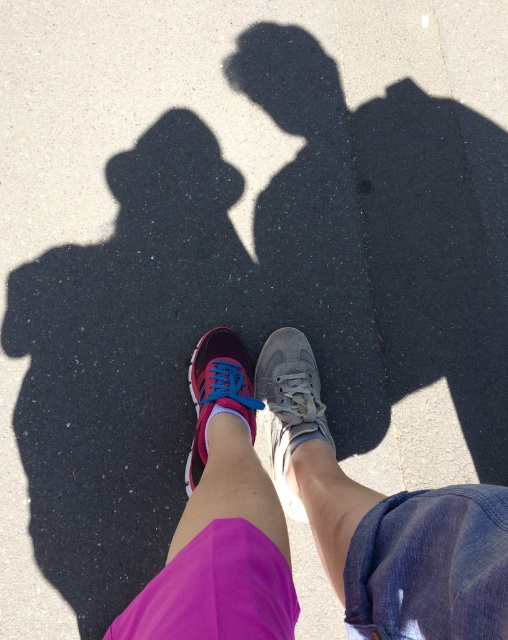
Does pink fabric shorts at lower center appear on the right side of shiny pink running shoe at center?

Correct, you'll find pink fabric shorts at lower center to the right of shiny pink running shoe at center.

Is pink fabric shorts at lower center closer to the viewer compared to shiny pink running shoe at center?

Yes, pink fabric shorts at lower center is in front of shiny pink running shoe at center.

Is point (396, 593) farther from camera compared to point (190, 381)?

No.

Where is `pink fabric shorts at lower center`? Image resolution: width=508 pixels, height=640 pixels. pink fabric shorts at lower center is located at coordinates (311, 522).

Is point (272, 408) behind point (313, 390)?

No, it is not.

Looking at this image, is pink fabric shorts at lower center closer to camera compared to gray fabric sneaker at center?

That is True.

Does point (465, 624) come farther from viewer compared to point (307, 426)?

No, (465, 624) is in front of (307, 426).

Locate an element on the screen. pink fabric shorts at lower center is located at coordinates (311, 522).

Who is positioned more to the left, gray fabric sneaker at center or shiny pink running shoe at center?

Positioned to the left is shiny pink running shoe at center.

Can you confirm if gray fabric sneaker at center is shorter than shiny pink running shoe at center?

In fact, gray fabric sneaker at center may be taller than shiny pink running shoe at center.

Is point (292, 416) positioned in front of point (201, 412)?

No, it is behind (201, 412).

You are a GUI agent. You are given a task and a screenshot of the screen. Output one action in this format:
    pyautogui.click(x=<x>, y=<y>)
    Task: Click on the gray fabric sneaker at center
    Image resolution: width=508 pixels, height=640 pixels.
    Given the screenshot: What is the action you would take?
    pyautogui.click(x=290, y=404)